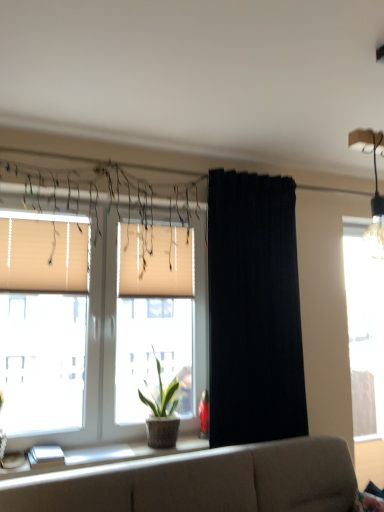
This screenshot has height=512, width=384. I want to click on free location above beige fabric blinds at left, the first window blind positioned from the front (from a real-world perspective), so click(x=49, y=219).